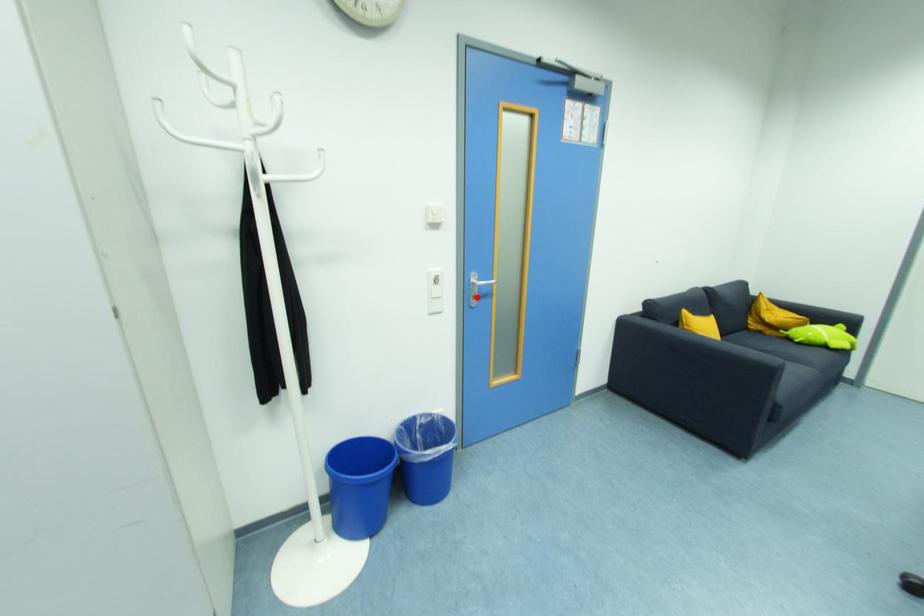
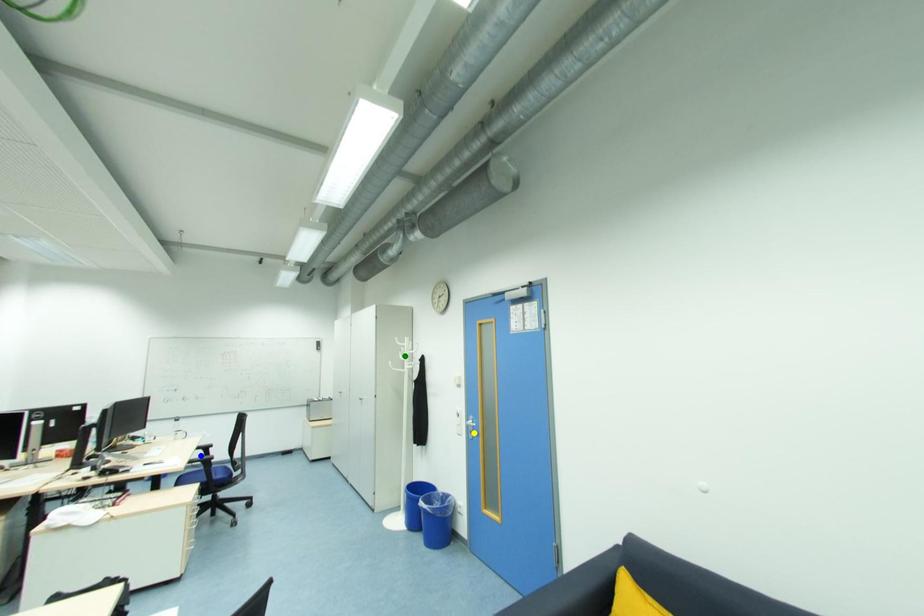
Question: I am providing you with two images of the same scene from different viewpoints. A red point is marked on the first image. You are given multiple points on the second image. Which point in image 2 is actually the same real-world point as the red point in image 1?

Choices:
 (A) blue point
 (B) green point
 (C) yellow point

Answer: (C)